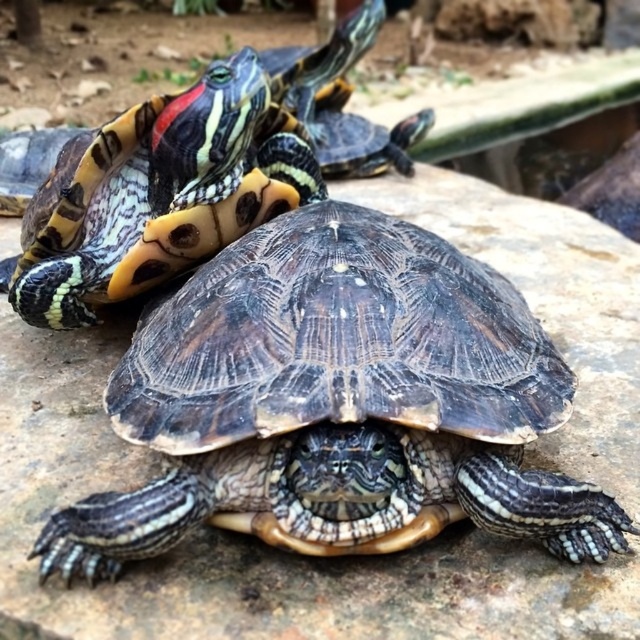
You are standing 1.04 meters away from the point at coordinates point (38,540). If you want to move closer to the turtles, which direction should you walk?

Since you are 1.04 meters away from the point at coordinates point (38,540), you should walk towards the turtles to get closer to them.

You are a nature photographer aiming to capture both the shiny brown tortoise at center and the shiny black shell at center in a single shot. Based on their positions, which turtle is positioned lower in the frame?

The shiny brown tortoise at center is located below the shiny black shell at center, so it is positioned lower in the frame.

You are a photographer trying to capture both the shiny brown tortoise at center and the shiny black shell at center in a single shot. Which turtle should you focus on first to ensure both are in frame?

You should focus on the shiny brown tortoise at center first because it is in front of the shiny black shell at center, so by focusing on the front turtle, both will be in frame.